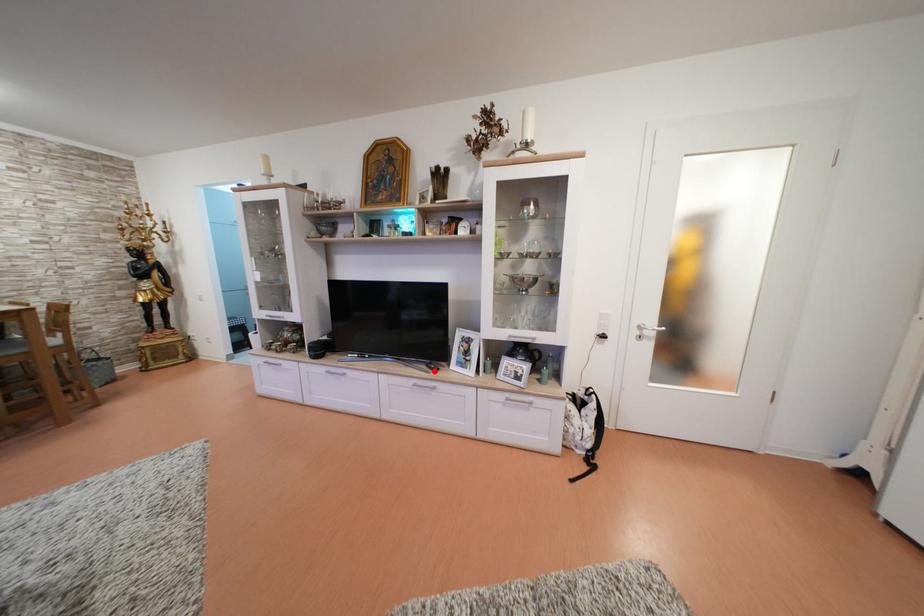
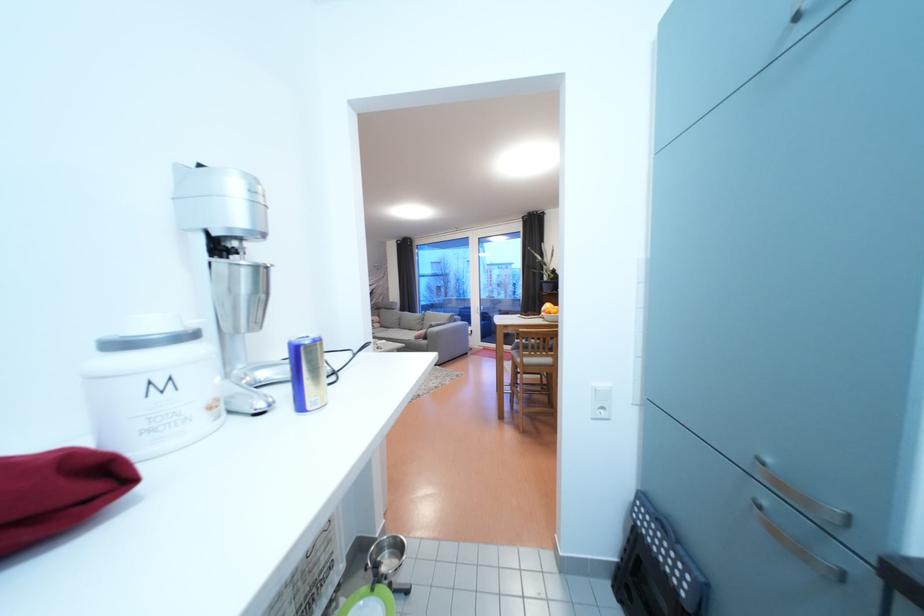
Question: I am providing you with two images of the same scene from different viewpoints. A red point is marked on the first image. Can you still see the location of the red point in image 2?

Choices:
 (A) Yes
 (B) No

Answer: (B)